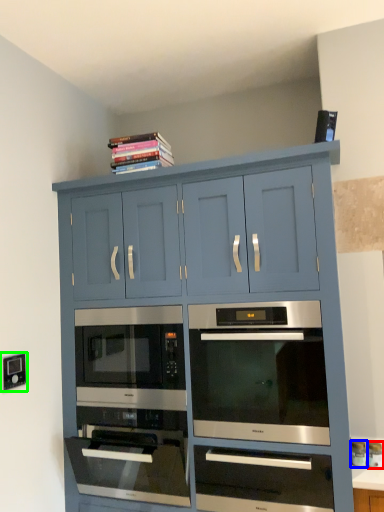
Question: Which object is positioned closest to appliance (highlighted by a red box)? Select from appliance (highlighted by a blue box) and electric outlet (highlighted by a green box).

Choices:
 (A) appliance
 (B) electric outlet

Answer: (A)